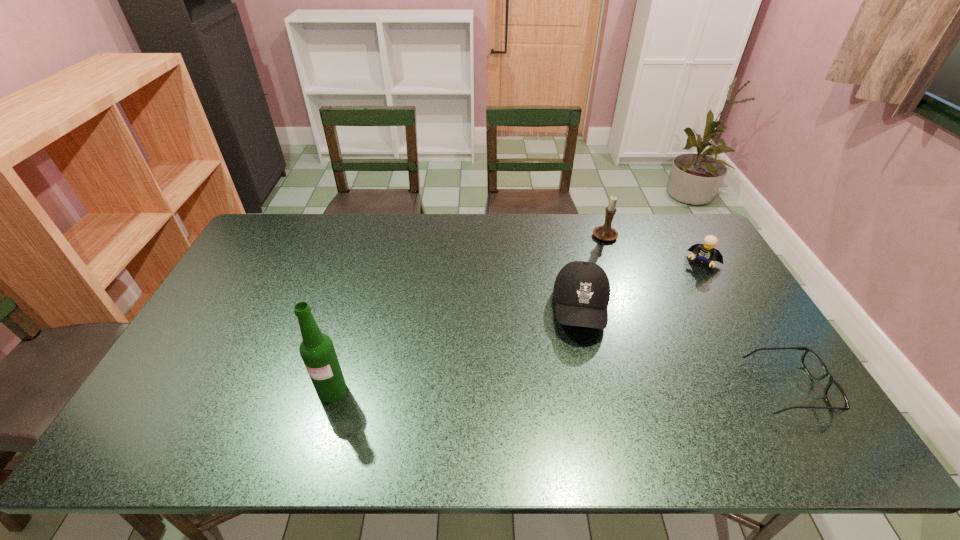
This screenshot has width=960, height=540. I want to click on free spot between the shortest object and the Lego, so click(745, 326).

At what (x,y) coordinates should I click in order to perform the action: click on free point between the fourth nearest object and the fourth object from right to left. Please return your answer as a coordinate pair (x, y). The image size is (960, 540). Looking at the image, I should click on (642, 287).

At what (x,y) coordinates should I click in order to perform the action: click on unoccupied area between the Lego and the leftmost object. Please return your answer as a coordinate pair (x, y). Looking at the image, I should click on (517, 327).

Locate an element on the screen. This screenshot has width=960, height=540. vacant point located between the leftmost object and the baseball cap is located at coordinates (457, 350).

You are a GUI agent. You are given a task and a screenshot of the screen. Output one action in this format:
    pyautogui.click(x=<x>, y=<y>)
    Task: Click on the free space between the fourth shortest object and the spectacles
    
    Given the screenshot: What is the action you would take?
    pyautogui.click(x=697, y=313)

What are the coordinates of `free space between the Lego and the candle holder` in the screenshot? It's located at (654, 251).

Where is `free spot between the beer bottle and the candle holder`? free spot between the beer bottle and the candle holder is located at coordinates (469, 314).

Where is `blank region between the third object from right to left and the second farthest object`? The height and width of the screenshot is (540, 960). blank region between the third object from right to left and the second farthest object is located at coordinates (654, 251).

Where is `vacant area between the farthest object and the Lego`? vacant area between the farthest object and the Lego is located at coordinates (654, 251).

The height and width of the screenshot is (540, 960). Identify the location of vacant area that lies between the second tallest object and the second farthest object. (654, 251).